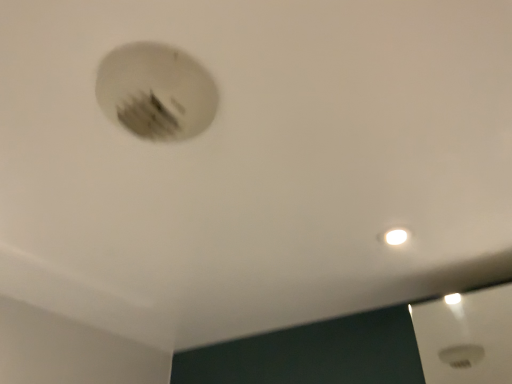
This screenshot has height=384, width=512. What do you see at coordinates (156, 92) in the screenshot? I see `white matte smoke detector at upper center` at bounding box center [156, 92].

Where is `white matte smoke detector at upper center`? The width and height of the screenshot is (512, 384). white matte smoke detector at upper center is located at coordinates (156, 92).

The image size is (512, 384). Identify the location of white matte smoke detector at upper center. click(x=156, y=92).